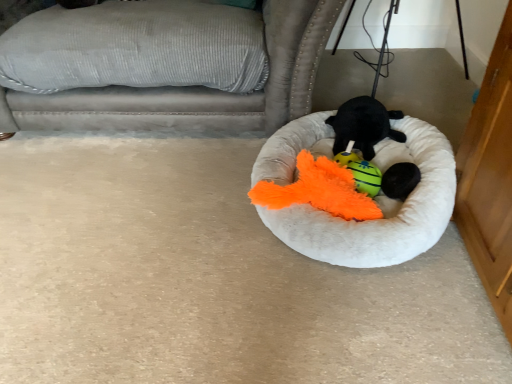
Image resolution: width=512 pixels, height=384 pixels. Find the location of `white fluffy dog bed at center`. white fluffy dog bed at center is located at coordinates (380, 208).

What do you see at coordinates (380, 208) in the screenshot? The width and height of the screenshot is (512, 384). I see `white fluffy dog bed at center` at bounding box center [380, 208].

Identify the location of black fuzzy ball at center. The image size is (512, 384). (400, 180).

How many degrees apart are the facing directions of black fuzzy ball at center and fluffy orange toy at center, acting as the first toy starting from the bottom?

1.74e-05 degrees.

Which of these two, black fuzzy ball at center or fluffy orange toy at center, acting as the first toy starting from the bottom, is wider?

Wider between the two is black fuzzy ball at center.

Consider the image. Considering the positions of objects black fuzzy ball at center and fluffy orange toy at center, the second toy in the top-to-bottom sequence, in the image provided, who is behind, black fuzzy ball at center or fluffy orange toy at center, the second toy in the top-to-bottom sequence,?

fluffy orange toy at center, the second toy in the top-to-bottom sequence, is behind.

Does black fuzzy ball at center have a greater height compared to fluffy orange toy at center, the second toy in the top-to-bottom sequence?

In fact, black fuzzy ball at center may be shorter than fluffy orange toy at center, the second toy in the top-to-bottom sequence.

Does fluffy orange toy at center, the second toy in the top-to-bottom sequence, contain white fluffy dog bed at center?

Definitely not — white fluffy dog bed at center is not inside fluffy orange toy at center, the second toy in the top-to-bottom sequence.

Find the location of a particular element. The height and width of the screenshot is (384, 512). the 1st toy to the right of the white fluffy dog bed at center, starting your count from the anchor is located at coordinates (360, 171).

Is fluffy orange toy at center, the second toy in the top-to-bottom sequence, taller than white fluffy dog bed at center?

No.

From a real-world perspective, is fluffy orange toy at center, acting as the first toy starting from the bottom, physically located above or below white fluffy dog bed at center?

In terms of real-world spatial position, fluffy orange toy at center, acting as the first toy starting from the bottom, is above white fluffy dog bed at center.

Is black fuzzy ball at center shorter than white fluffy dog bed at center?

Indeed, black fuzzy ball at center has a lesser height compared to white fluffy dog bed at center.

In the scene shown: Is black fuzzy ball at center turned away from white fluffy dog bed at center?

Yes, black fuzzy ball at center's orientation is away from white fluffy dog bed at center.

Looking at the image, does black fuzzy ball at center seem bigger or smaller compared to white fluffy dog bed at center?

In the image, black fuzzy ball at center appears to be smaller than white fluffy dog bed at center.

From a real-world perspective, which object rests below the other?

white fluffy dog bed at center.

In terms of height, does gray corduroy couch at upper left look taller or shorter compared to white fluffy dog bed at center?

Clearly, gray corduroy couch at upper left is taller compared to white fluffy dog bed at center.

Would you say gray corduroy couch at upper left is to the left or to the right of white fluffy dog bed at center in the picture?

In the image, gray corduroy couch at upper left appears on the left side of white fluffy dog bed at center.

Can you confirm if fluffy orange toy at center, the second toy in the top-to-bottom sequence, is positioned to the right of soft plush toy at center, which appears as the second toy when ordered from the bottom?

No, fluffy orange toy at center, the second toy in the top-to-bottom sequence, is not to the right of soft plush toy at center, which appears as the second toy when ordered from the bottom.

Considering the relative sizes of fluffy orange toy at center, the second toy in the top-to-bottom sequence, and soft plush toy at center, the 1th toy positioned from the top, in the image provided, is fluffy orange toy at center, the second toy in the top-to-bottom sequence, taller than soft plush toy at center, the 1th toy positioned from the top,?

No.

Is fluffy orange toy at center, acting as the first toy starting from the bottom, not within soft plush toy at center, the 1th toy positioned from the top?

Yes, fluffy orange toy at center, acting as the first toy starting from the bottom, is located beyond the bounds of soft plush toy at center, the 1th toy positioned from the top.

Is fluffy orange toy at center, the second toy in the top-to-bottom sequence, wider or thinner than soft plush toy at center, which appears as the second toy when ordered from the bottom?

Clearly, fluffy orange toy at center, the second toy in the top-to-bottom sequence, has less width compared to soft plush toy at center, which appears as the second toy when ordered from the bottom.

Would you say white fluffy dog bed at center is a long distance from fluffy orange toy at center, acting as the first toy starting from the bottom?

Actually, white fluffy dog bed at center and fluffy orange toy at center, acting as the first toy starting from the bottom, are a little close together.

From a real-world perspective, relative to fluffy orange toy at center, acting as the first toy starting from the bottom, is white fluffy dog bed at center vertically above or below?

From a real-world perspective, white fluffy dog bed at center is physically below fluffy orange toy at center, acting as the first toy starting from the bottom.

Is white fluffy dog bed at center smaller than fluffy orange toy at center, the second toy in the top-to-bottom sequence?

No, white fluffy dog bed at center is not smaller than fluffy orange toy at center, the second toy in the top-to-bottom sequence.

Identify the location of toy below the white fluffy dog bed at center (from the image's perspective). The height and width of the screenshot is (384, 512). (360, 171).

Which object is more forward, fluffy orange toy at center, the second toy in the top-to-bottom sequence, or black fuzzy ball at center?

black fuzzy ball at center is more forward.

Locate an element on the screen. The image size is (512, 384). the 1st toy positioned above the black fuzzy ball at center (from the image's perspective) is located at coordinates (360, 171).

From the image's perspective, is fluffy orange toy at center, acting as the first toy starting from the bottom, below black fuzzy ball at center?

No, from the image's perspective, fluffy orange toy at center, acting as the first toy starting from the bottom, is not beneath black fuzzy ball at center.

Is fluffy orange toy at center, the second toy in the top-to-bottom sequence, wider or thinner than black fuzzy ball at center?

Clearly, fluffy orange toy at center, the second toy in the top-to-bottom sequence, has less width compared to black fuzzy ball at center.

Locate an element on the screen. The width and height of the screenshot is (512, 384). the 1st toy behind the black fuzzy ball at center is located at coordinates (360, 171).

You are a GUI agent. You are given a task and a screenshot of the screen. Output one action in this format:
    pyautogui.click(x=<x>, y=<y>)
    Task: Click on the dog bed on the left of the fluffy orange toy at center, the second toy in the top-to-bottom sequence
    The image size is (512, 384).
    Given the screenshot: What is the action you would take?
    pyautogui.click(x=380, y=208)

Based on their spatial positions, is soft plush toy at center, which appears as the second toy when ordered from the bottom, or gray corduroy couch at upper left closer to black fuzzy ball at center?

soft plush toy at center, which appears as the second toy when ordered from the bottom, lies closer to black fuzzy ball at center than the other object.

Looking at the image, which one is located closer to black fuzzy ball at center, fluffy orange toy at center, acting as the first toy starting from the bottom, or white fluffy dog bed at center?

The object closer to black fuzzy ball at center is fluffy orange toy at center, acting as the first toy starting from the bottom.

Considering their positions, is fluffy orange toy at center, the second toy in the top-to-bottom sequence, positioned further to gray corduroy couch at upper left than black fuzzy ball at center?

black fuzzy ball at center is positioned further to the anchor gray corduroy couch at upper left.

When comparing their distances from white fluffy dog bed at center, does soft plush toy at center, which appears as the second toy when ordered from the bottom, or black fuzzy ball at center seem further?

black fuzzy ball at center is further to white fluffy dog bed at center.

When comparing their distances from soft plush toy at center, the 1th toy positioned from the top, does white fluffy dog bed at center or gray corduroy couch at upper left seem further?

Among the two, gray corduroy couch at upper left is located further to soft plush toy at center, the 1th toy positioned from the top.

Based on their spatial positions, is black fuzzy ball at center or white fluffy dog bed at center closer to gray corduroy couch at upper left?

white fluffy dog bed at center lies closer to gray corduroy couch at upper left than the other object.

Which object lies nearer to the anchor point white fluffy dog bed at center, gray corduroy couch at upper left or soft plush toy at center, the 1th toy positioned from the top?

Among the two, soft plush toy at center, the 1th toy positioned from the top, is located nearer to white fluffy dog bed at center.

Estimate the real-world distances between objects in this image. Which object is further from fluffy orange toy at center, the second toy in the top-to-bottom sequence, black fuzzy ball at center or white fluffy dog bed at center?

white fluffy dog bed at center is further to fluffy orange toy at center, the second toy in the top-to-bottom sequence.

You are a GUI agent. You are given a task and a screenshot of the screen. Output one action in this format:
    pyautogui.click(x=<x>, y=<y>)
    Task: Click on the dog bed situated between gray corduroy couch at upper left and black fuzzy ball at center from left to right
    This screenshot has height=384, width=512.
    Given the screenshot: What is the action you would take?
    pyautogui.click(x=380, y=208)

This screenshot has width=512, height=384. Identify the location of animal between white fluffy dog bed at center and soft plush toy at center, which appears as the second toy when ordered from the bottom, from front to back. (400, 180).

Where is `toy located between white fluffy dog bed at center and soft plush toy at center, which appears as the second toy when ordered from the bottom, in the depth direction`? toy located between white fluffy dog bed at center and soft plush toy at center, which appears as the second toy when ordered from the bottom, in the depth direction is located at coordinates (360, 171).

Where is `toy between gray corduroy couch at upper left and soft plush toy at center, which appears as the second toy when ordered from the bottom`? This screenshot has height=384, width=512. toy between gray corduroy couch at upper left and soft plush toy at center, which appears as the second toy when ordered from the bottom is located at coordinates (360, 171).